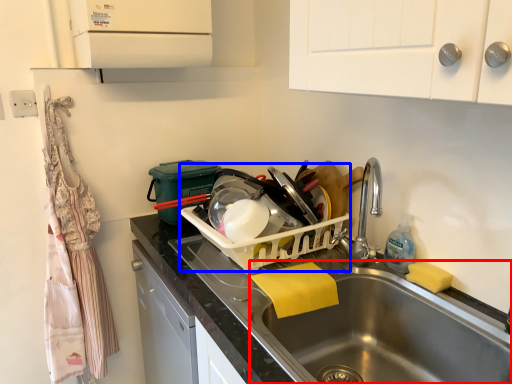
Question: Which of the following is the closest to the observer, sink (highlighted by a red box) or appliance (highlighted by a blue box)?

Choices:
 (A) sink
 (B) appliance

Answer: (A)